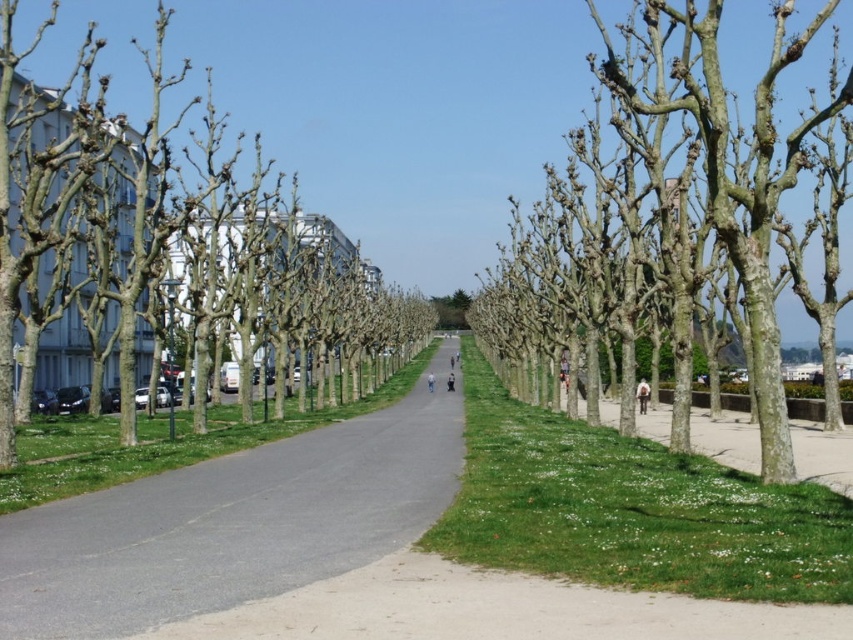
Question: Can you confirm if bark textured trees at center is positioned above smooth bark tree at left?

Choices:
 (A) no
 (B) yes

Answer: (A)

Question: Is gray asphalt road at center above bark textured trees at center?

Choices:
 (A) no
 (B) yes

Answer: (A)

Question: Does bark textured trees at center appear on the right side of smooth bark tree at left?

Choices:
 (A) yes
 (B) no

Answer: (A)

Question: Considering the real-world distances, which object is closest to the bark textured trees at center?

Choices:
 (A) gray asphalt road at center
 (B) smooth bark tree at left

Answer: (B)

Question: Which point is farther to the camera?

Choices:
 (A) smooth bark tree at left
 (B) bark textured trees at center

Answer: (A)

Question: Which is nearer to the bark textured trees at center?

Choices:
 (A) gray asphalt road at center
 (B) smooth bark tree at left

Answer: (B)